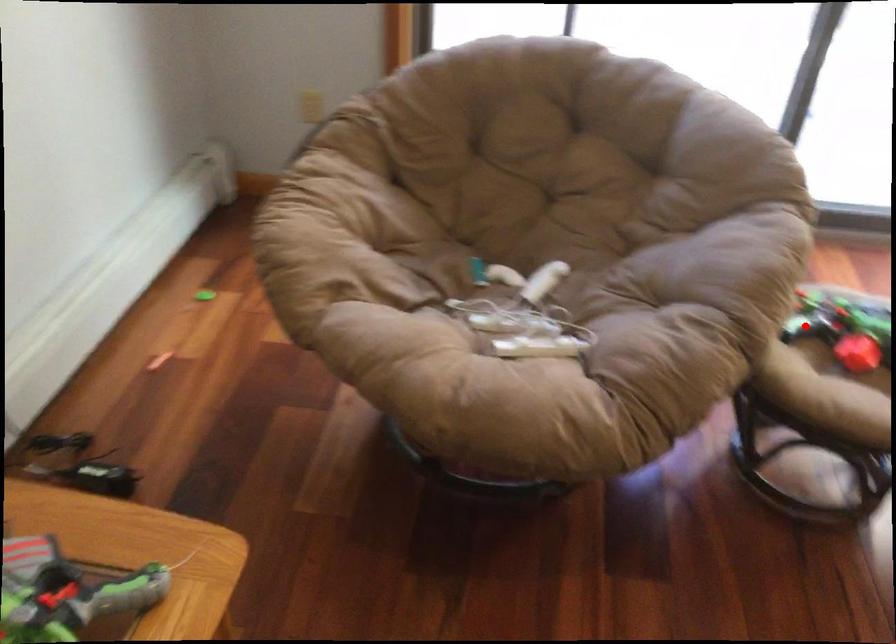
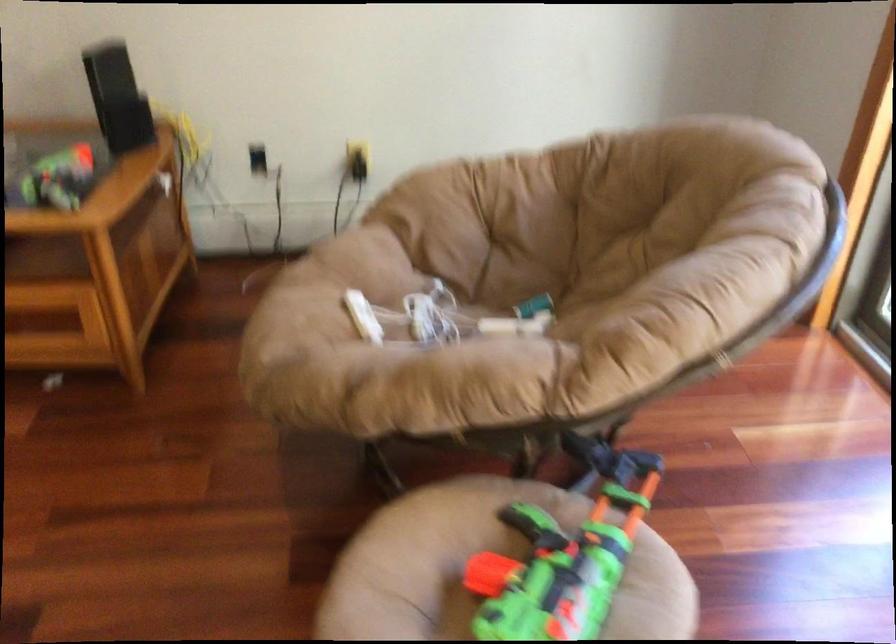
Question: I am providing you with two images of the same scene from different viewpoints. Image1 has a red point marked. In image2, the corresponding 3D location appears at what relative position? Reply with the corresponding letter.

Choices:
 (A) Closer
 (B) Farther

Answer: (A)